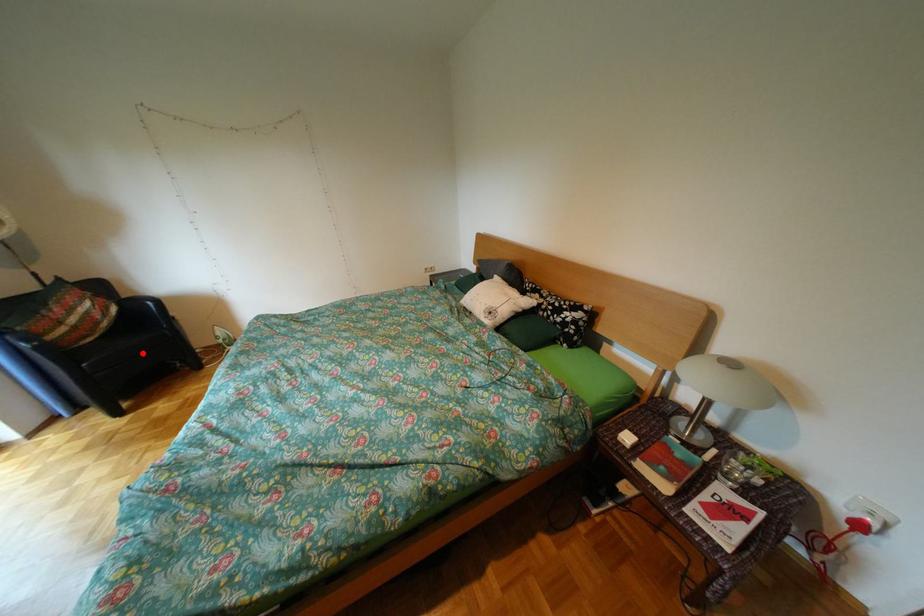
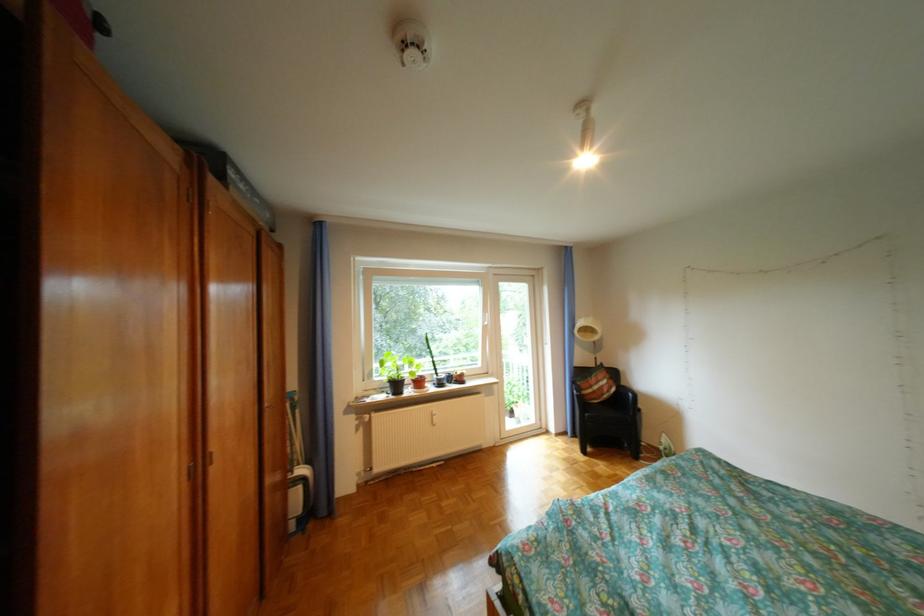
Where in the second image is the point corresponding to the highlighted location from the first image?

(621, 419)